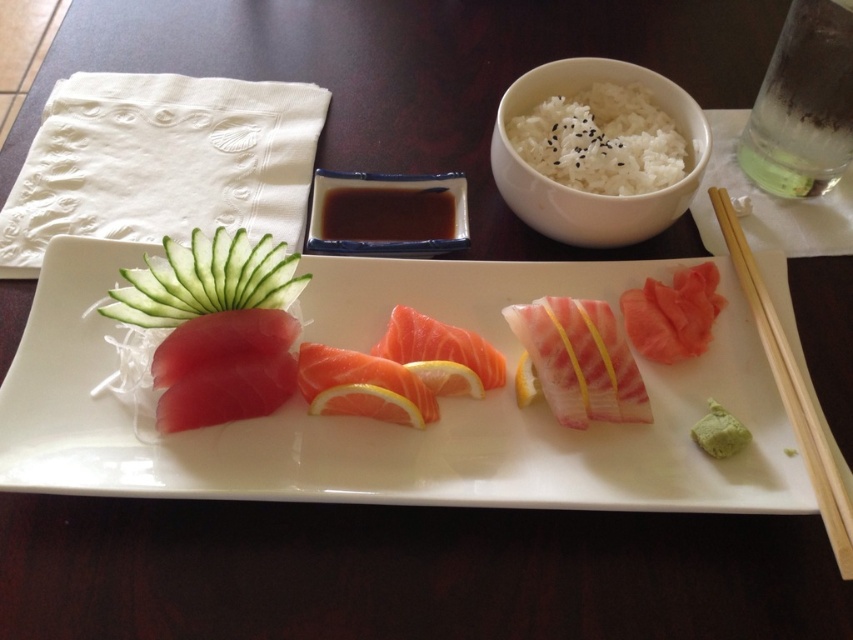
What are the coordinates of the white matte rice bowl at upper center?

The white matte rice bowl at upper center is located at coordinates point (x=579, y=189).

You are a sushi chef preparing a platter. You have a pink raw salmon at center and a green paste at bottom right. Which one has a larger width?

The pink raw salmon at center has a larger width than the green paste at bottom right.

You are a sushi chef preparing a platter. You have a sashimi plate at center and a pink glossy salmon at center. Which object is bigger?

The sashimi plate at center is larger in size compared to the pink glossy salmon at center.